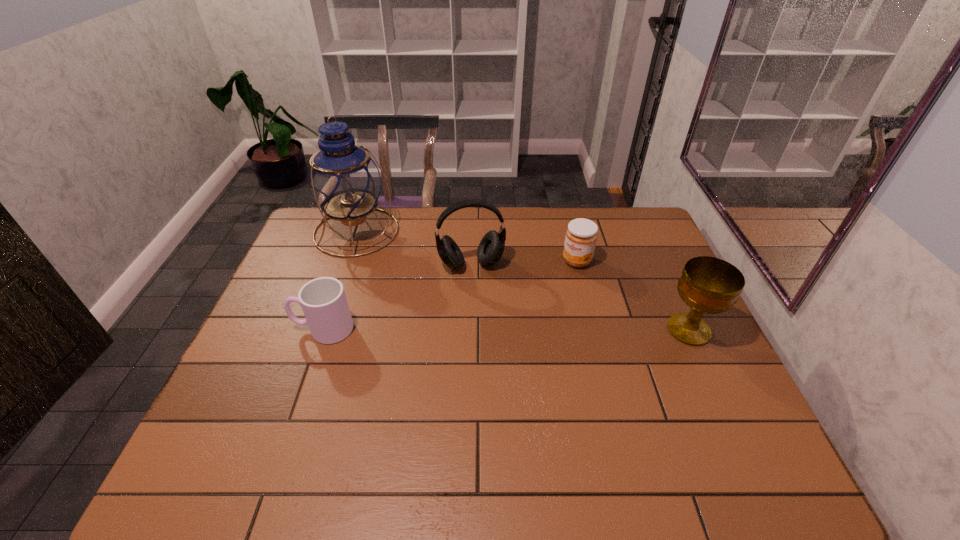
Where is `vacant space situated 0.060m on the ear cups of the headset`? vacant space situated 0.060m on the ear cups of the headset is located at coordinates (480, 290).

The image size is (960, 540). What are the coordinates of `vacant space situated on the ear cups of the headset` in the screenshot? It's located at (492, 341).

Where is `vacant area situated on the front-facing side of the tallest object`? Image resolution: width=960 pixels, height=540 pixels. vacant area situated on the front-facing side of the tallest object is located at coordinates (401, 275).

Locate an element on the screen. blank space located 0.260m on the front-facing side of the tallest object is located at coordinates (420, 293).

This screenshot has height=540, width=960. What are the coordinates of `vacant space located on the front-facing side of the tallest object` in the screenshot? It's located at (398, 272).

Image resolution: width=960 pixels, height=540 pixels. I want to click on object at the far edge, so click(344, 181).

Image resolution: width=960 pixels, height=540 pixels. I want to click on cup at the left edge, so click(323, 300).

Where is `lantern that is at the left edge`? The width and height of the screenshot is (960, 540). lantern that is at the left edge is located at coordinates 344,181.

Identify the location of object located at the right edge. This screenshot has height=540, width=960. (708, 285).

At what (x,y) coordinates should I click in order to perform the action: click on object that is positioned at the far left corner. Please return your answer as a coordinate pair (x, y). Looking at the image, I should click on (344, 181).